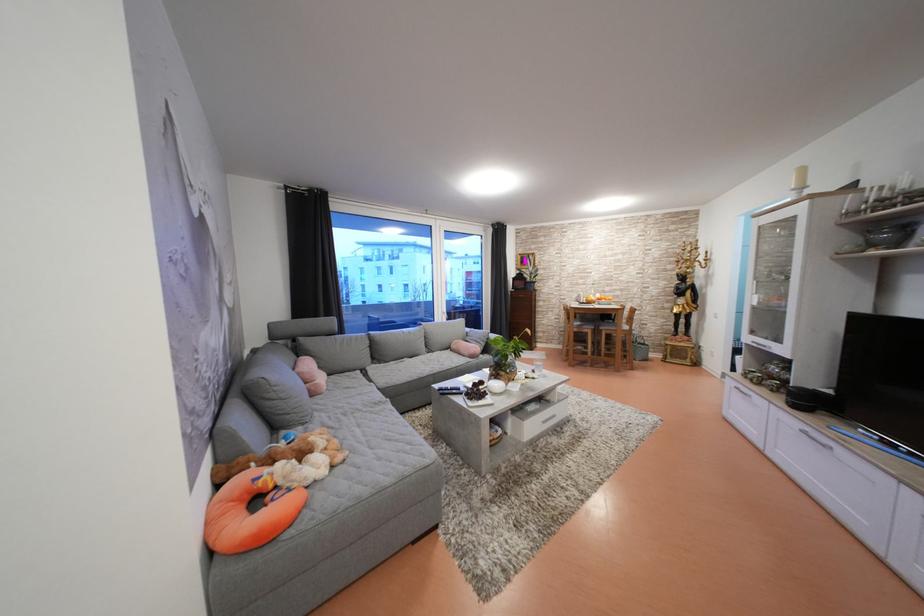
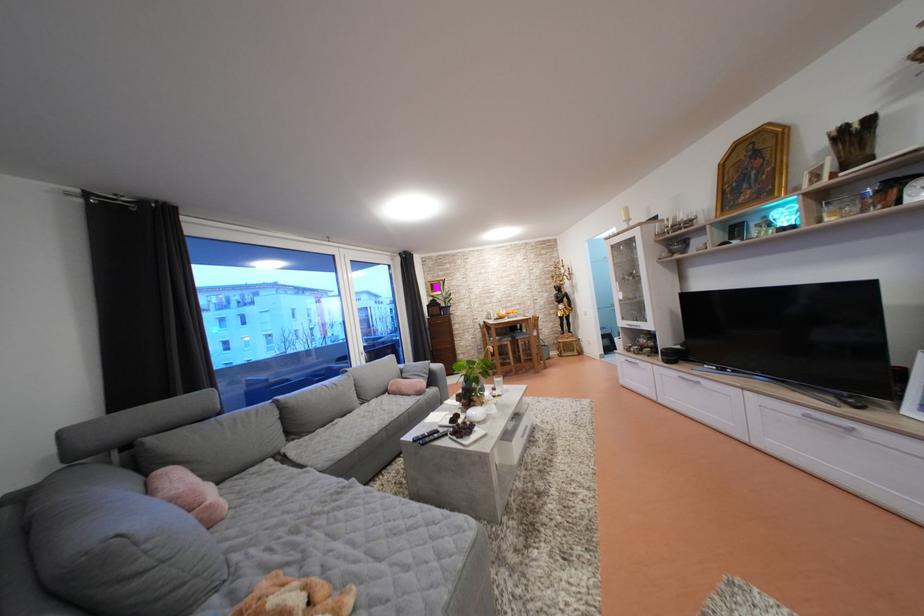
Where in the second image is the point corresponding to the point at 815,434 from the first image?

(688, 379)